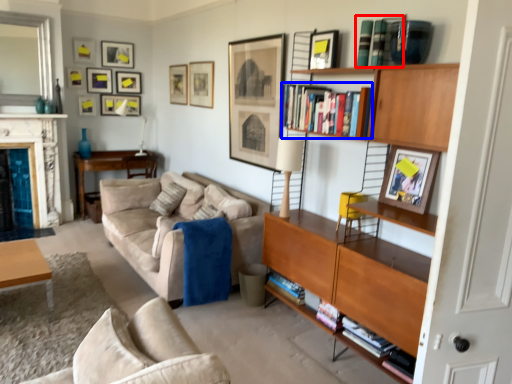
Question: Which object appears closest to the camera in this image, book (highlighted by a red box) or book (highlighted by a blue box)?

Choices:
 (A) book
 (B) book

Answer: (A)